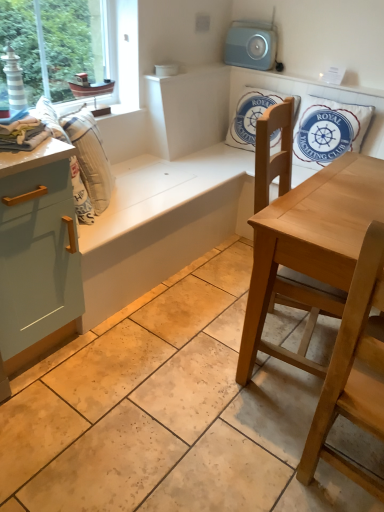
Question: Is white striped fabric at left at the right side of light blue plastic radio at upper center?

Choices:
 (A) no
 (B) yes

Answer: (A)

Question: Could you tell me if white striped fabric at left is turned towards light blue plastic radio at upper center?

Choices:
 (A) yes
 (B) no

Answer: (B)

Question: Is white striped fabric at left next to light blue plastic radio at upper center?

Choices:
 (A) no
 (B) yes

Answer: (A)

Question: Can you confirm if white striped fabric at left is taller than light blue plastic radio at upper center?

Choices:
 (A) yes
 (B) no

Answer: (A)

Question: Is light blue plastic radio at upper center inside white striped fabric at left?

Choices:
 (A) no
 (B) yes

Answer: (A)

Question: From the image's perspective, is white striped fabric at left located above light blue plastic radio at upper center?

Choices:
 (A) yes
 (B) no

Answer: (B)

Question: Is white cotton cushion at upper right, arranged as the second pillow when viewed from the left, to the left of white cotton towel at left from the viewer's perspective?

Choices:
 (A) no
 (B) yes

Answer: (A)

Question: From a real-world perspective, is white cotton cushion at upper right, the 1th pillow viewed from the right, physically above white cotton towel at left?

Choices:
 (A) no
 (B) yes

Answer: (A)

Question: Considering the relative sizes of white cotton cushion at upper right, arranged as the second pillow when viewed from the left, and white cotton towel at left in the image provided, is white cotton cushion at upper right, arranged as the second pillow when viewed from the left, smaller than white cotton towel at left?

Choices:
 (A) no
 (B) yes

Answer: (A)

Question: Is white cotton towel at left at the back of white cotton cushion at upper right, arranged as the second pillow when viewed from the left?

Choices:
 (A) no
 (B) yes

Answer: (A)

Question: Considering the relative sizes of white cotton cushion at upper right, the 1th pillow viewed from the right, and white cotton towel at left in the image provided, is white cotton cushion at upper right, the 1th pillow viewed from the right, shorter than white cotton towel at left?

Choices:
 (A) no
 (B) yes

Answer: (A)

Question: Are white cotton cushion at upper right, the 1th pillow viewed from the right, and white cotton towel at left far apart?

Choices:
 (A) yes
 (B) no

Answer: (A)

Question: Considering the relative sizes of light wood chair at lower right, marked as the 1th chair in a front-to-back arrangement, and white striped fabric at left in the image provided, is light wood chair at lower right, marked as the 1th chair in a front-to-back arrangement, smaller than white striped fabric at left?

Choices:
 (A) no
 (B) yes

Answer: (A)